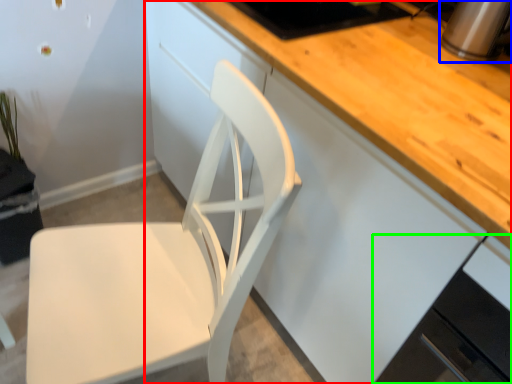
Question: Which is nearer to the cabinetry (highlighted by a red box)? appliance (highlighted by a blue box) or cabinetry (highlighted by a green box).

Choices:
 (A) appliance
 (B) cabinetry

Answer: (B)